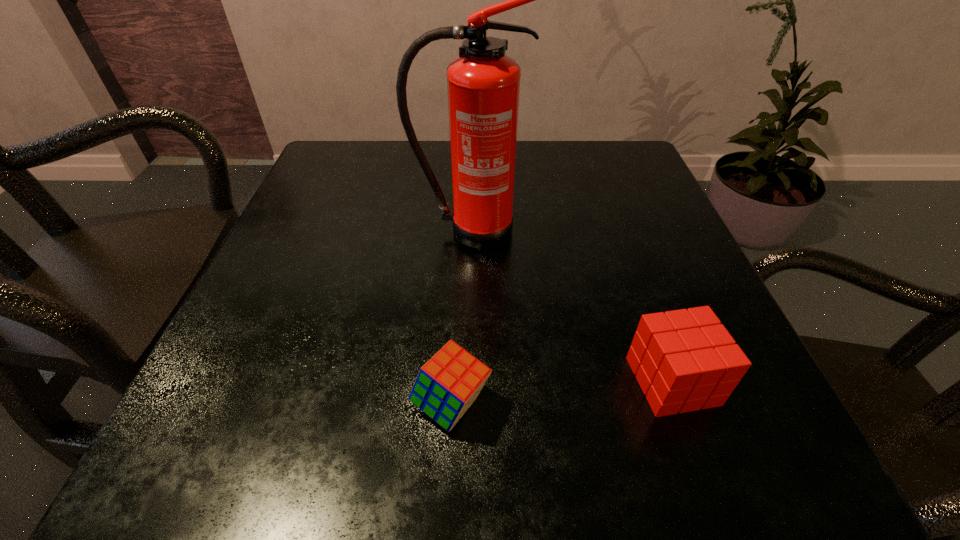
Where is `unoccupied area between the right cube and the left cube`? unoccupied area between the right cube and the left cube is located at coordinates (562, 393).

Where is `free space between the left cube and the tallest object`? free space between the left cube and the tallest object is located at coordinates (460, 318).

What are the coordinates of `free space between the farthest object and the left cube` in the screenshot? It's located at (460, 318).

Locate an element on the screen. Image resolution: width=960 pixels, height=540 pixels. free area in between the fire extinguisher and the rightmost object is located at coordinates (570, 306).

Locate an element on the screen. vacant area that lies between the right cube and the left cube is located at coordinates (562, 393).

What are the coordinates of `free space between the left cube and the tallest object` in the screenshot? It's located at (460, 318).

You are a GUI agent. You are given a task and a screenshot of the screen. Output one action in this format:
    pyautogui.click(x=<x>, y=<y>)
    Task: Click on the free space between the farthest object and the left cube
    
    Given the screenshot: What is the action you would take?
    pos(460,318)

Find the location of a particular element. object identified as the closest to the left cube is located at coordinates (684, 360).

Locate an element on the screen. This screenshot has width=960, height=540. object that stands as the second closest to the rightmost object is located at coordinates (483, 84).

Locate an element on the screen. Image resolution: width=960 pixels, height=540 pixels. vacant position in the image that satisfies the following two spatial constraints: 1. at the nozzle of the tallest object; 2. on the left side of the right cube is located at coordinates (464, 381).